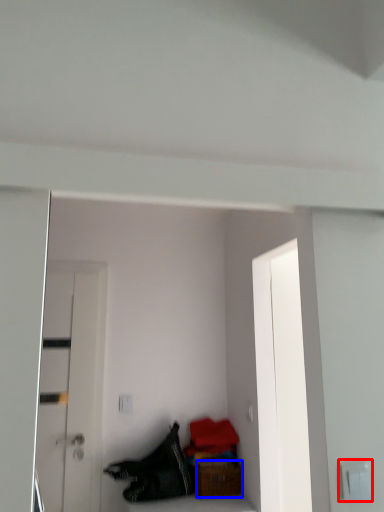
Question: Which object is closer to the camera taking this photo, electric outlet (highlighted by a red box) or furniture (highlighted by a blue box)?

Choices:
 (A) electric outlet
 (B) furniture

Answer: (A)